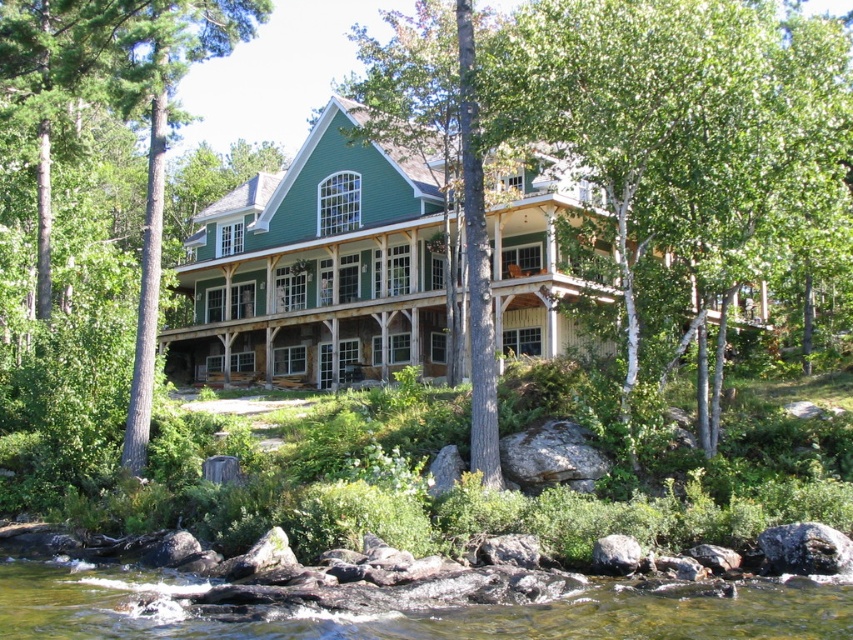
Question: Does wooden porch at center lie in front of green wood tree at center?

Choices:
 (A) yes
 (B) no

Answer: (A)

Question: Which of the following is the closest to the observer?

Choices:
 (A) (241, 8)
 (B) (352, 332)
 (C) (483, 627)

Answer: (C)

Question: Which of the following is the closest to the observer?

Choices:
 (A) green wood tree at center
 (B) clear water at lower center
 (C) wooden porch at center

Answer: (B)

Question: Does wooden porch at center have a smaller size compared to clear water at lower center?

Choices:
 (A) yes
 (B) no

Answer: (B)

Question: Which object appears closest to the camera in this image?

Choices:
 (A) wooden porch at center
 (B) green wood tree at center
 (C) clear water at lower center

Answer: (C)

Question: Is clear water at lower center positioned behind green wood tree at center?

Choices:
 (A) no
 (B) yes

Answer: (A)